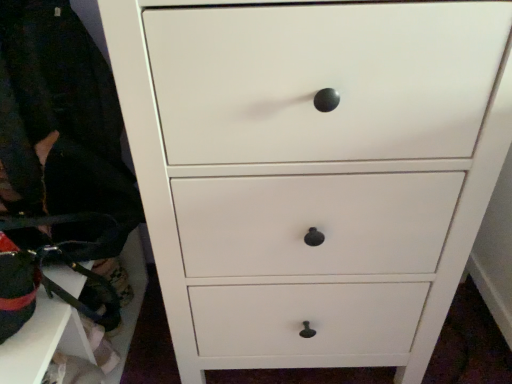
Question: Is white matte cabinet at lower left surrounded by black fabric at left?

Choices:
 (A) no
 (B) yes

Answer: (A)

Question: Is black fabric at left oriented towards white matte cabinet at lower left?

Choices:
 (A) yes
 (B) no

Answer: (B)

Question: From a real-world perspective, is black fabric at left physically below white matte cabinet at lower left?

Choices:
 (A) yes
 (B) no

Answer: (B)

Question: From the image's perspective, would you say black fabric at left is shown under white matte cabinet at lower left?

Choices:
 (A) yes
 (B) no

Answer: (B)

Question: Is black fabric at left positioned with its back to white matte cabinet at lower left?

Choices:
 (A) no
 (B) yes

Answer: (A)

Question: Considering the relative positions of black fabric at left and white matte cabinet at lower left in the image provided, is black fabric at left to the right of white matte cabinet at lower left from the viewer's perspective?

Choices:
 (A) yes
 (B) no

Answer: (A)

Question: From a real-world perspective, does white matte cabinet at lower left sit lower than black fabric at left?

Choices:
 (A) no
 (B) yes

Answer: (B)

Question: Would you say white matte cabinet at lower left is a long distance from black fabric at left?

Choices:
 (A) no
 (B) yes

Answer: (A)

Question: Is white matte cabinet at lower left at the left side of black fabric at left?

Choices:
 (A) yes
 (B) no

Answer: (A)

Question: Is white matte cabinet at lower left surrounding black fabric at left?

Choices:
 (A) no
 (B) yes

Answer: (A)

Question: Considering the relative sizes of white matte cabinet at lower left and black fabric at left in the image provided, is white matte cabinet at lower left wider than black fabric at left?

Choices:
 (A) yes
 (B) no

Answer: (B)

Question: Is white matte cabinet at lower left with black fabric at left?

Choices:
 (A) yes
 (B) no

Answer: (B)

Question: Looking at their shapes, would you say white matte cabinet at lower left is wider or thinner than black fabric at left?

Choices:
 (A) wide
 (B) thin

Answer: (B)